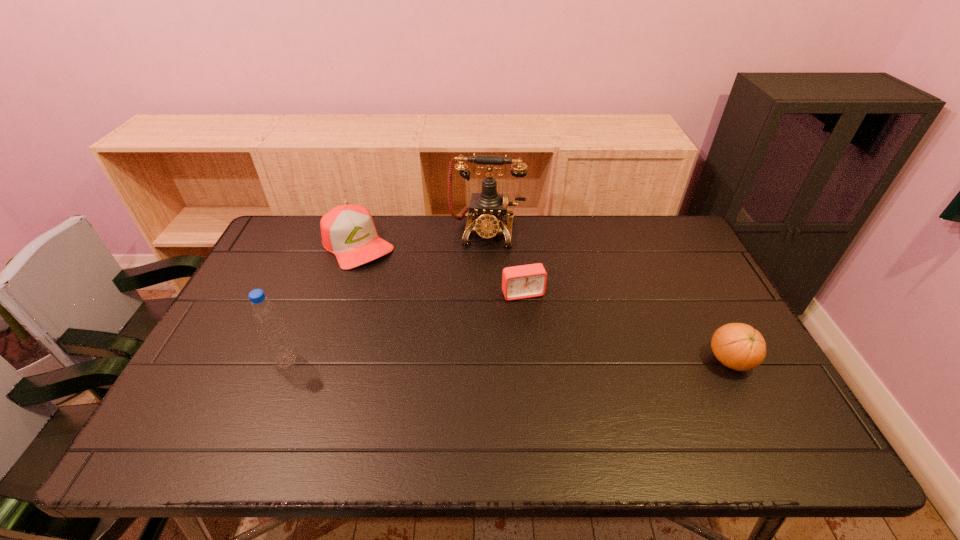
Locate an element on the screen. The width and height of the screenshot is (960, 540). the fourth shortest object is located at coordinates (266, 317).

Image resolution: width=960 pixels, height=540 pixels. What are the coordinates of `orange` in the screenshot? It's located at (738, 346).

Find the location of a particular element. The width and height of the screenshot is (960, 540). baseball cap is located at coordinates (348, 231).

I want to click on the shortest object, so click(525, 281).

This screenshot has height=540, width=960. I want to click on alarm clock, so click(525, 281).

At what (x,y) coordinates should I click in order to perform the action: click on telephone. Please return your answer as a coordinate pair (x, y). Looking at the image, I should click on (489, 207).

Identify the location of free spot located 0.150m on the left of the water bottle. This screenshot has height=540, width=960. (215, 361).

Where is `blank space located 0.100m on the left of the orange`? The width and height of the screenshot is (960, 540). blank space located 0.100m on the left of the orange is located at coordinates (667, 361).

Where is `vacant space situated 0.130m on the front-facing side of the baseball cap`? vacant space situated 0.130m on the front-facing side of the baseball cap is located at coordinates (396, 287).

The image size is (960, 540). Identify the location of vacant space located on the front-facing side of the baseball cap. (428, 322).